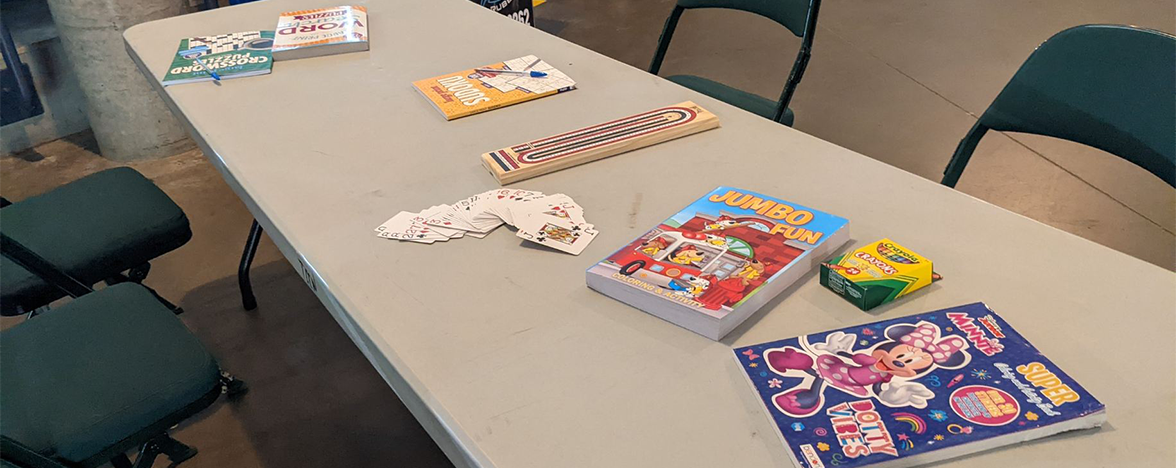
Where is `chair`? The width and height of the screenshot is (1176, 468). chair is located at coordinates (1132, 68), (794, 24), (115, 244), (109, 384).